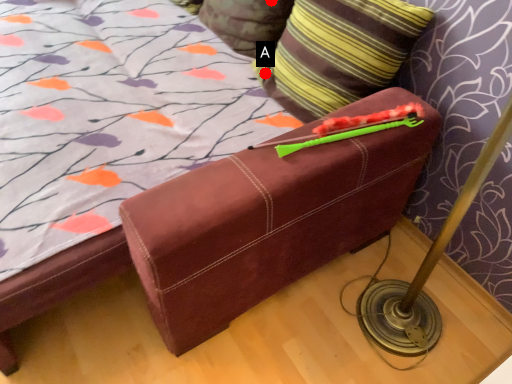
Question: Two points are circled on the image, labeled by A and B beside each circle. Among these points, which one is farthest from the camera?

Choices:
 (A) A is further
 (B) B is further

Answer: (B)